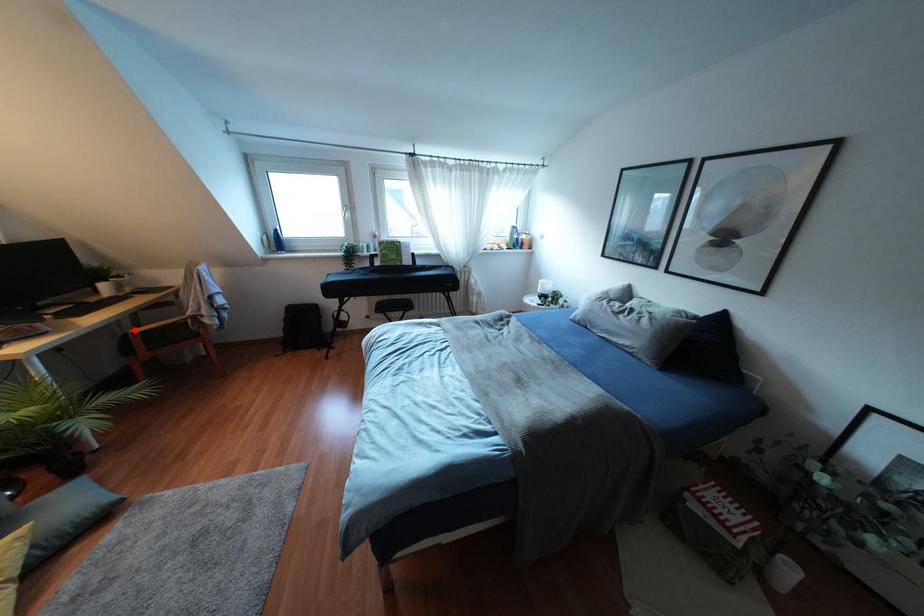
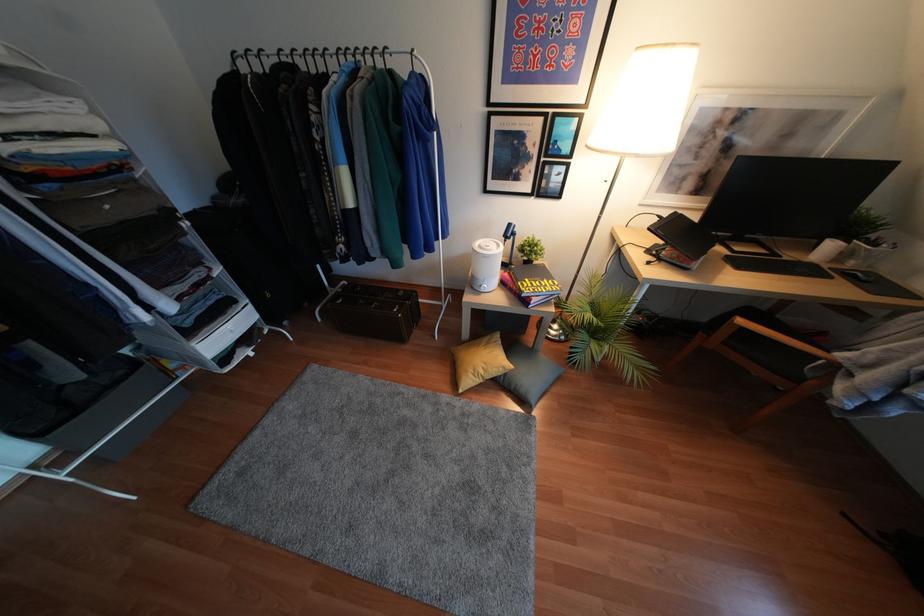
Find the pixel in the second image that matches the highlighted location in the first image.

(739, 321)